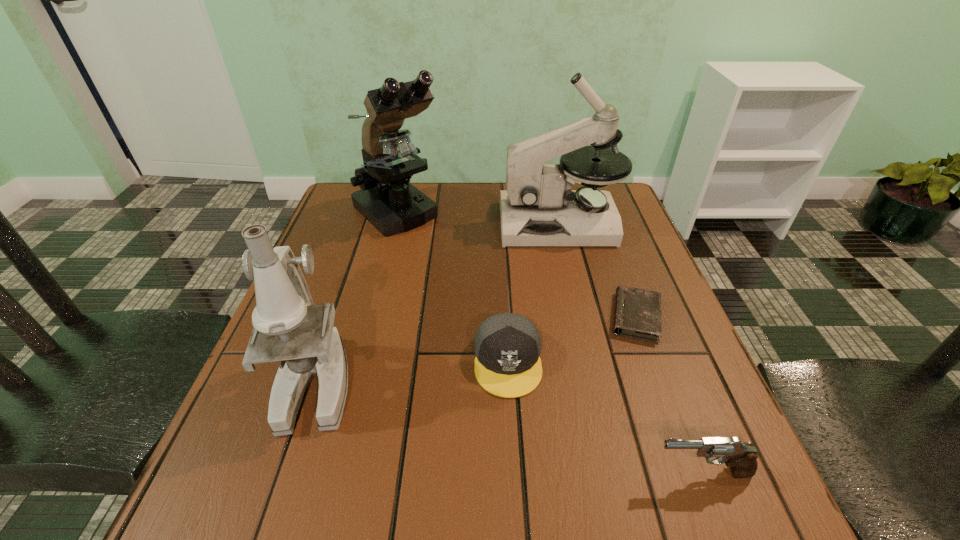
Locate an element on the screen. This screenshot has width=960, height=540. the rightmost microscope is located at coordinates pos(538,208).

What are the coordinates of `the nearest microscope` in the screenshot? It's located at (284, 303).

Find the location of a particular element. The height and width of the screenshot is (540, 960). the fourth tallest object is located at coordinates click(741, 458).

Find the location of a particular element. Image resolution: width=960 pixels, height=540 pixels. pistol is located at coordinates (741, 458).

Where is `cap`? Image resolution: width=960 pixels, height=540 pixels. cap is located at coordinates (507, 346).

The height and width of the screenshot is (540, 960). Identify the location of diary. (637, 314).

Find the location of a particular element. Image resolution: width=960 pixels, height=540 pixels. free space located 0.260m at the eyepiece of the rightmost microscope is located at coordinates (406, 224).

Find the location of `vacant space located at the eyepiece of the rightmost microscope`. vacant space located at the eyepiece of the rightmost microscope is located at coordinates (479, 224).

Where is `vacant space situated at the eyepiece of the rightmost microscope`? vacant space situated at the eyepiece of the rightmost microscope is located at coordinates (468, 224).

The width and height of the screenshot is (960, 540). What are the coordinates of `free location located 0.220m on the back of the nearest microscope` in the screenshot? It's located at (355, 269).